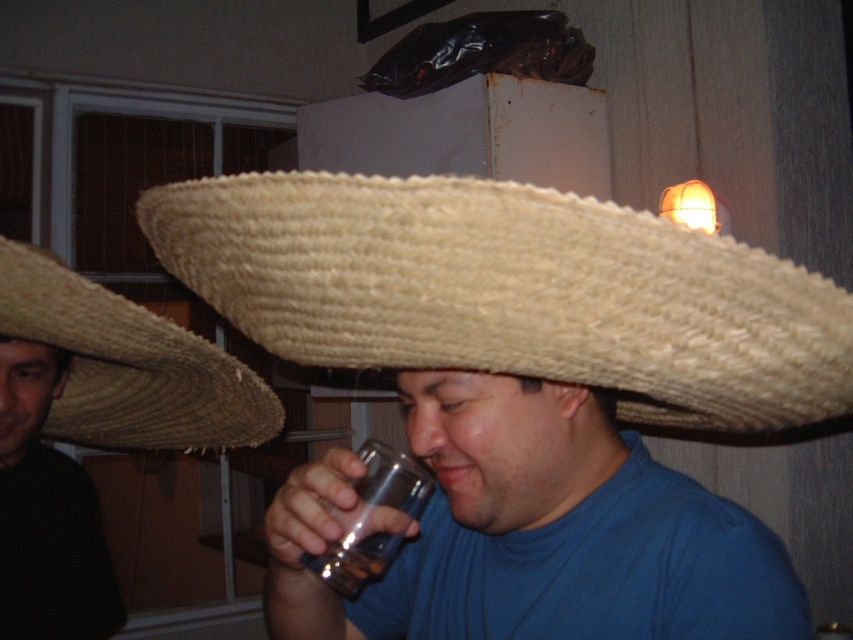
Who is positioned more to the right, natural straw sombrero at center or transparent glass at lower center?

natural straw sombrero at center

Does natural straw sombrero at center lie behind transparent glass at lower center?

No, it is not.

Does point (457, 196) come in front of point (386, 513)?

Yes, it is.

At what (x,y) coordinates should I click in order to perform the action: click on natural straw sombrero at center. Please return your answer as a coordinate pair (x, y). Looking at the image, I should click on (509, 291).

The height and width of the screenshot is (640, 853). What do you see at coordinates (509, 291) in the screenshot? I see `natural straw sombrero at center` at bounding box center [509, 291].

Based on the photo, does natural straw sombrero at center have a lesser width compared to woven straw sombrero at left?

No.

You are a GUI agent. You are given a task and a screenshot of the screen. Output one action in this format:
    pyautogui.click(x=<x>, y=<y>)
    Task: Click on the natural straw sombrero at center
    The image size is (853, 640).
    Given the screenshot: What is the action you would take?
    pyautogui.click(x=509, y=291)

This screenshot has height=640, width=853. What are the coordinates of `natural straw sombrero at center` in the screenshot? It's located at (509, 291).

Does point (155, 442) lie in front of point (349, 576)?

No, (155, 442) is behind (349, 576).

Who is more distant from viewer, (113, 310) or (346, 525)?

Positioned behind is point (113, 310).

I want to click on woven straw sombrero at upper left, so [129, 365].